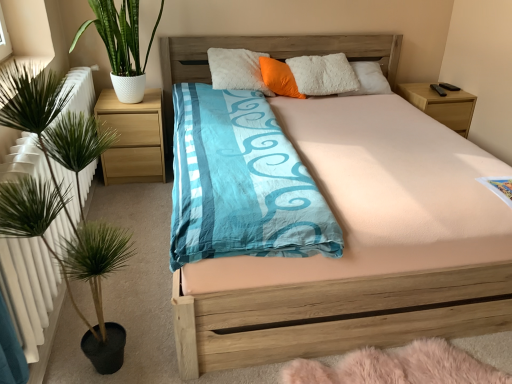
Question: Is green leafy plant at left, marked as the 1th houseplant in a front-to-back arrangement, smaller than light wood/texture nightstand at right, placed as the 1th nightstand when sorted from right to left?

Choices:
 (A) yes
 (B) no

Answer: (B)

Question: From a real-world perspective, is green leafy plant at left, marked as the 1th houseplant in a front-to-back arrangement, on top of light wood/texture nightstand at right, which is the 2th nightstand from left to right?

Choices:
 (A) yes
 (B) no

Answer: (A)

Question: Are green leafy plant at left, which ranks as the 2th houseplant in back-to-front order, and light wood/texture nightstand at right, which is the 2th nightstand from left to right, far apart?

Choices:
 (A) yes
 (B) no

Answer: (A)

Question: From a real-world perspective, is green leafy plant at left, the 1th houseplant from the bottom, under light wood/texture nightstand at right, which is the 2th nightstand from left to right?

Choices:
 (A) yes
 (B) no

Answer: (B)

Question: Is green leafy plant at left, the 1th houseplant from the bottom, placed right next to light wood/texture nightstand at right, placed as the 1th nightstand when sorted from right to left?

Choices:
 (A) no
 (B) yes

Answer: (A)

Question: Can we say green leafy plant at left, marked as the second houseplant in a top-to-bottom arrangement, lies outside light wood/texture nightstand at right, which is the 2th nightstand from left to right?

Choices:
 (A) no
 (B) yes

Answer: (B)

Question: Does wooden bed at center have a larger size compared to green leafy plant at left, marked as the 1th houseplant in a front-to-back arrangement?

Choices:
 (A) no
 (B) yes

Answer: (B)

Question: Considering the relative sizes of wooden bed at center and green leafy plant at left, marked as the second houseplant in a top-to-bottom arrangement, in the image provided, is wooden bed at center shorter than green leafy plant at left, marked as the second houseplant in a top-to-bottom arrangement,?

Choices:
 (A) yes
 (B) no

Answer: (A)

Question: Does wooden bed at center have a lesser width compared to green leafy plant at left, marked as the 1th houseplant in a front-to-back arrangement?

Choices:
 (A) no
 (B) yes

Answer: (A)

Question: Is wooden bed at center facing away from green leafy plant at left, which ranks as the 2th houseplant in back-to-front order?

Choices:
 (A) no
 (B) yes

Answer: (A)

Question: Can you confirm if wooden bed at center is smaller than green leafy plant at left, marked as the 1th houseplant in a front-to-back arrangement?

Choices:
 (A) yes
 (B) no

Answer: (B)

Question: Does wooden bed at center appear on the left side of green leafy plant at left, marked as the 1th houseplant in a front-to-back arrangement?

Choices:
 (A) no
 (B) yes

Answer: (A)

Question: Would you say wooden bed at center is a long distance from orange fabric pillow at center?

Choices:
 (A) no
 (B) yes

Answer: (B)